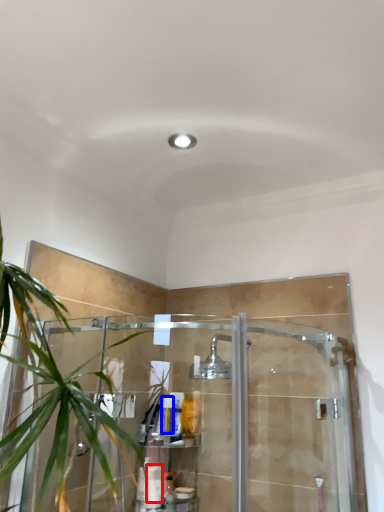
Question: Which object appears farthest to the camera in this image, toiletry (highlighted by a red box) or toiletry (highlighted by a blue box)?

Choices:
 (A) toiletry
 (B) toiletry

Answer: (B)